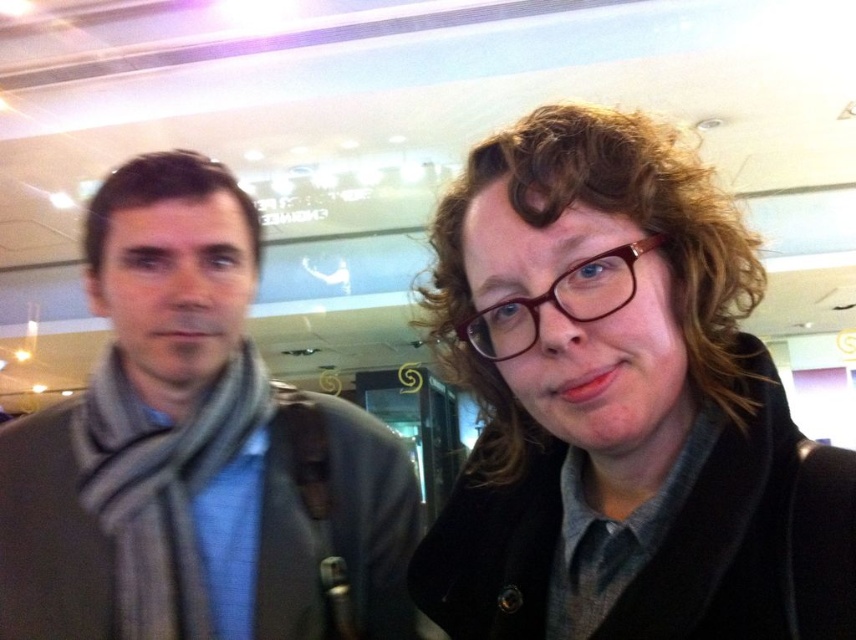
Question: Among these points, which one is farthest from the camera?

Choices:
 (A) (132, 209)
 (B) (696, 410)

Answer: (A)

Question: From the image, what is the correct spatial relationship of gray wool scarf at left in relation to brown matte glasses at center?

Choices:
 (A) left
 (B) right

Answer: (A)

Question: Is matte black coat at right thinner than brown matte glasses at center?

Choices:
 (A) no
 (B) yes

Answer: (A)

Question: Which object appears farthest from the camera in this image?

Choices:
 (A) matte black coat at right
 (B) brown matte glasses at center
 (C) gray wool scarf at left

Answer: (C)

Question: Which object is farther from the camera taking this photo?

Choices:
 (A) gray wool scarf at left
 (B) matte black coat at right

Answer: (A)

Question: Observing the image, what is the correct spatial positioning of gray wool scarf at left in reference to brown matte glasses at center?

Choices:
 (A) left
 (B) right

Answer: (A)